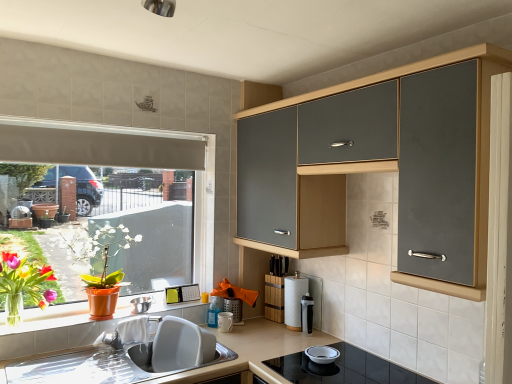
This screenshot has height=384, width=512. Identify the location of vacant point to the right of black plastic water bottle at upper right, which is the 6th appliance in left-to-right order. (330, 342).